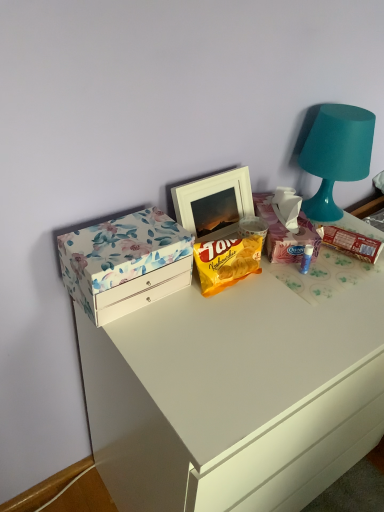
You are a GUI agent. You are given a task and a screenshot of the screen. Output one action in this format:
    pyautogui.click(x=<x>, y=<y>)
    Task: Click on the empty space that is ontop of floral paper box at left (from a real-world perspective)
    Image resolution: width=384 pixels, height=512 pixels.
    Given the screenshot: What is the action you would take?
    pyautogui.click(x=130, y=234)